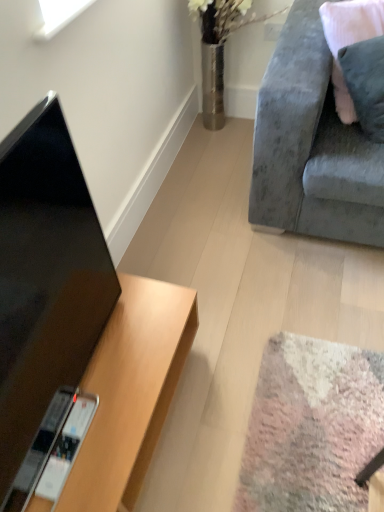
Question: Is velvet pink pillow at upper right not close to velvet grey couch at upper right?

Choices:
 (A) yes
 (B) no

Answer: (B)

Question: Does velvet pink pillow at upper right appear on the left side of velvet grey couch at upper right?

Choices:
 (A) yes
 (B) no

Answer: (B)

Question: Are velvet pink pillow at upper right and velvet grey couch at upper right beside each other?

Choices:
 (A) no
 (B) yes

Answer: (A)

Question: Is velvet pink pillow at upper right looking in the opposite direction of velvet grey couch at upper right?

Choices:
 (A) no
 (B) yes

Answer: (B)

Question: Is velvet pink pillow at upper right smaller than velvet grey couch at upper right?

Choices:
 (A) yes
 (B) no

Answer: (A)

Question: Is velvet pink pillow at upper right to the left or to the right of wooden desk at lower left in the image?

Choices:
 (A) left
 (B) right

Answer: (B)

Question: From the image's perspective, is velvet pink pillow at upper right above or below wooden desk at lower left?

Choices:
 (A) below
 (B) above

Answer: (B)

Question: In the image, is velvet pink pillow at upper right positioned in front of or behind wooden desk at lower left?

Choices:
 (A) behind
 (B) front

Answer: (A)

Question: In terms of width, does velvet pink pillow at upper right look wider or thinner when compared to wooden desk at lower left?

Choices:
 (A) thin
 (B) wide

Answer: (A)

Question: Based on their sizes in the image, would you say wooden desk at lower left is bigger or smaller than velvet grey couch at upper right?

Choices:
 (A) small
 (B) big

Answer: (A)

Question: Considering their positions, is wooden desk at lower left located in front of or behind velvet grey couch at upper right?

Choices:
 (A) front
 (B) behind

Answer: (A)

Question: In terms of width, does wooden desk at lower left look wider or thinner when compared to velvet grey couch at upper right?

Choices:
 (A) wide
 (B) thin

Answer: (B)

Question: Which is correct: wooden desk at lower left is inside velvet grey couch at upper right, or outside of it?

Choices:
 (A) outside
 (B) inside

Answer: (A)

Question: Based on their sizes in the image, would you say black glossy tv at left is bigger or smaller than velvet pink pillow at upper right?

Choices:
 (A) small
 (B) big

Answer: (A)

Question: Would you say black glossy tv at left is to the left or to the right of velvet pink pillow at upper right in the picture?

Choices:
 (A) left
 (B) right

Answer: (A)